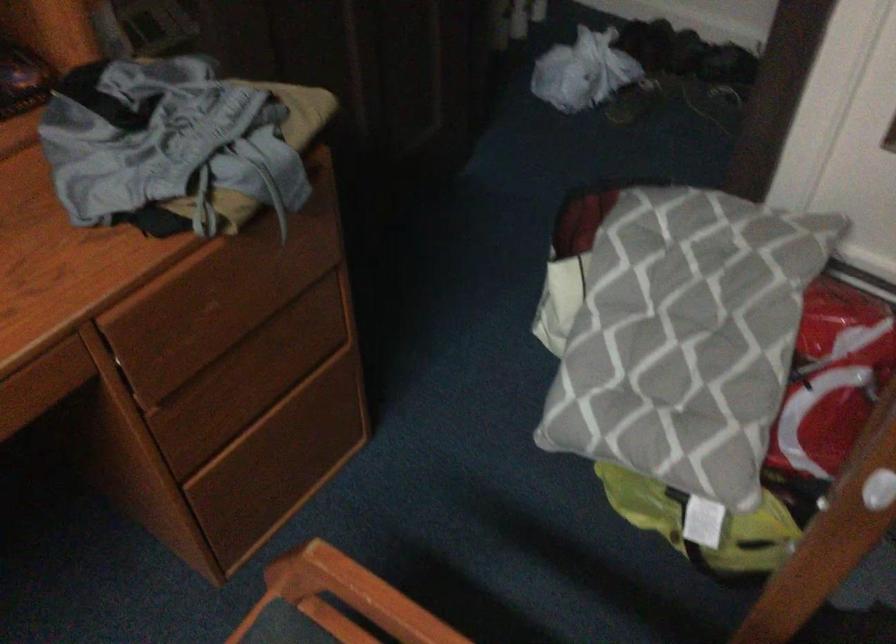
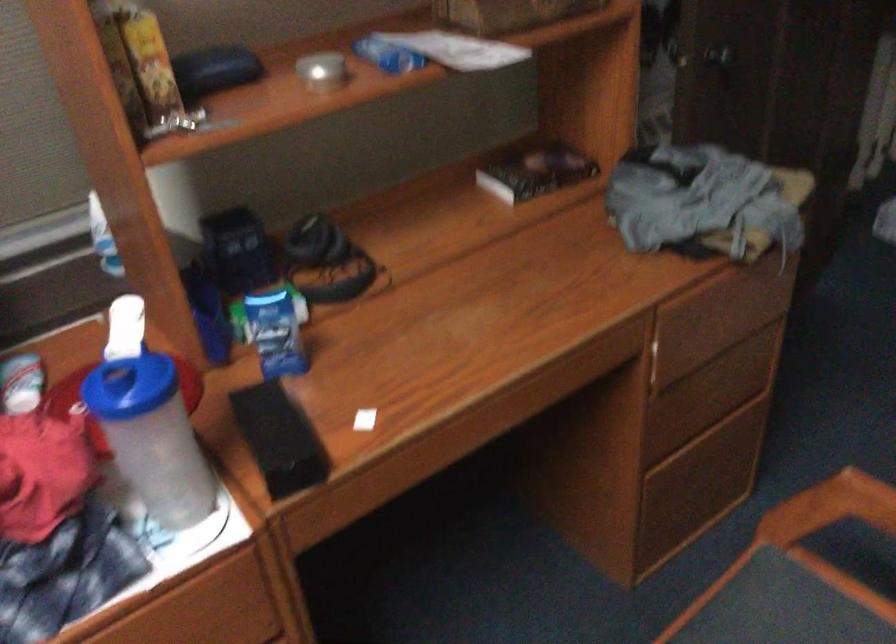
Question: I am providing you with two images of the same scene from different viewpoints. Which of the following objects are not visible in image2?

Choices:
 (A) black book
 (B) small silver container
 (C) blue plastic bottle
 (D) none of these

Answer: (D)